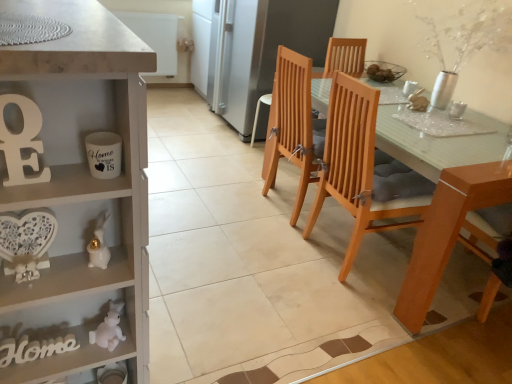
What do you see at coordinates (34, 349) in the screenshot?
I see `white wood home at lower left` at bounding box center [34, 349].

Describe the element at coordinates (252, 49) in the screenshot. The image size is (512, 384). I see `satin silver refrigerator at center` at that location.

Measure the distance between wooden chair with cushion at center, marked as the 2th chair in a right-to-left arrangement, and camera.

wooden chair with cushion at center, marked as the 2th chair in a right-to-left arrangement, is 1.73 meters away from camera.

Image resolution: width=512 pixels, height=384 pixels. Find the location of `white matte rabbit at lower left, which is counted as the first toy, starting from the back`. white matte rabbit at lower left, which is counted as the first toy, starting from the back is located at coordinates (109, 328).

How far apart are wooden chair with cushion at center, marked as the 2th chair in a right-to-left arrangement, and white painted wood cabinet at left?

wooden chair with cushion at center, marked as the 2th chair in a right-to-left arrangement, and white painted wood cabinet at left are 1.26 meters apart from each other.

From a real-world perspective, which object rests below the other?

wooden chair with cushion at center, marked as the 2th chair in a right-to-left arrangement, from a real-world perspective.

Can you tell me how much wooden chair with cushion at center, which ranks as the 2th chair in left-to-right order, and white painted wood cabinet at left differ in facing direction?

The angle between the facing direction of wooden chair with cushion at center, which ranks as the 2th chair in left-to-right order, and the facing direction of white painted wood cabinet at left is 0.36 degrees.

Considering the sizes of objects wooden chair with cushion at center, marked as the 2th chair in a right-to-left arrangement, and white painted wood cabinet at left in the image provided, who is smaller, wooden chair with cushion at center, marked as the 2th chair in a right-to-left arrangement, or white painted wood cabinet at left?

With smaller size is wooden chair with cushion at center, marked as the 2th chair in a right-to-left arrangement.

From a real-world perspective, between satin silver refrigerator at center and clear glass cup at upper right, positioned as the second coffee cup in top-to-bottom order, who is vertically higher?

In real-world perspective, clear glass cup at upper right, positioned as the second coffee cup in top-to-bottom order, is above.

Is clear glass cup at upper right, which is the 2th coffee cup in bottom-to-top order, surrounded by satin silver refrigerator at center?

No, satin silver refrigerator at center does not contain clear glass cup at upper right, which is the 2th coffee cup in bottom-to-top order.

Who is bigger, satin silver refrigerator at center or clear glass cup at upper right, which is the third coffee cup in left-to-right order?

satin silver refrigerator at center is bigger.

Which object is thinner, satin silver refrigerator at center or clear glass cup at upper right, positioned as the second coffee cup in top-to-bottom order?

clear glass cup at upper right, positioned as the second coffee cup in top-to-bottom order.

From the image's perspective, does white matte letter e at left appear higher than wooden chair at right, positioned as the 3th chair in left-to-right order?

Correct, white matte letter e at left appears higher than wooden chair at right, positioned as the 3th chair in left-to-right order, in the image.

Is white matte letter e at left looking in the opposite direction of wooden chair at right, placed as the 1th chair when sorted from right to left?

No, white matte letter e at left's orientation is not away from wooden chair at right, placed as the 1th chair when sorted from right to left.

Considering the sizes of objects white matte letter e at left and wooden chair at right, positioned as the 3th chair in left-to-right order, in the image provided, who is smaller, white matte letter e at left or wooden chair at right, positioned as the 3th chair in left-to-right order,?

white matte letter e at left.

In the image, is white matte letter e at left positioned in front of or behind wooden chair at right, placed as the 1th chair when sorted from right to left?

Clearly, white matte letter e at left is in front of wooden chair at right, placed as the 1th chair when sorted from right to left.

Is satin silver refrigerator at center inside the boundaries of wooden chair with cushion at center, marked as the 2th chair in a right-to-left arrangement, or outside?

satin silver refrigerator at center is outside wooden chair with cushion at center, marked as the 2th chair in a right-to-left arrangement.

Is satin silver refrigerator at center not near wooden chair with cushion at center, which ranks as the 2th chair in left-to-right order?

satin silver refrigerator at center is positioned a significant distance from wooden chair with cushion at center, which ranks as the 2th chair in left-to-right order.

Considering the relative sizes of satin silver refrigerator at center and wooden chair with cushion at center, which ranks as the 2th chair in left-to-right order, in the image provided, is satin silver refrigerator at center thinner than wooden chair with cushion at center, which ranks as the 2th chair in left-to-right order,?

In fact, satin silver refrigerator at center might be wider than wooden chair with cushion at center, which ranks as the 2th chair in left-to-right order.

The height and width of the screenshot is (384, 512). In order to click on toy that is the 1st object to the left of the clear glass cup at upper right, the 1th coffee cup from the right, starting at the anchor in this screenshot , I will do `click(99, 244)`.

From a real-world perspective, which object stands above the other?

clear glass cup at upper right, the 1th coffee cup from the right, is physically above.

Is the surface of clear glass cup at upper right, the 1th coffee cup from the right, in direct contact with white glossy rabbit at lower left, the first toy viewed from the front?

No.

Is wooden chair at right, placed as the 1th chair when sorted from right to left, in front of white painted wood cabinet at left?

No, wooden chair at right, placed as the 1th chair when sorted from right to left, is behind white painted wood cabinet at left.

From a real-world perspective, relative to white painted wood cabinet at left, is wooden chair at right, positioned as the 3th chair in left-to-right order, vertically above or below?

Clearly, from a real-world perspective, wooden chair at right, positioned as the 3th chair in left-to-right order, is below white painted wood cabinet at left.

Considering the relative positions of wooden chair at right, positioned as the 3th chair in left-to-right order, and white painted wood cabinet at left in the image provided, is wooden chair at right, positioned as the 3th chair in left-to-right order, to the right of white painted wood cabinet at left from the viewer's perspective?

Yes, wooden chair at right, positioned as the 3th chair in left-to-right order, is to the right of white painted wood cabinet at left.

Does wooden chair at right, placed as the 1th chair when sorted from right to left, have a lesser width compared to white painted wood cabinet at left?

Incorrect, the width of wooden chair at right, placed as the 1th chair when sorted from right to left, is not less than that of white painted wood cabinet at left.

From the image's perspective, is clear glass cup at upper right, positioned as the second coffee cup in top-to-bottom order, over white matte rabbit at lower left, acting as the second toy starting from the front?

Indeed, from the image's perspective, clear glass cup at upper right, positioned as the second coffee cup in top-to-bottom order, is shown above white matte rabbit at lower left, acting as the second toy starting from the front.

Is clear glass cup at upper right, the 1th coffee cup from the right, behind white matte rabbit at lower left, which is counted as the first toy, starting from the back?

That is True.

Find the location of a particular element. This screenshot has width=512, height=384. the 2nd toy to the left of the clear glass cup at upper right, the 1th coffee cup from the right, starting your count from the anchor is located at coordinates (109, 328).

Identify the location of chair that is the 1st one below the white painted wood cabinet at left (from a real-world perspective). This screenshot has width=512, height=384. (366, 168).

Find the location of `fridge behind the clear glass cup at upper right, positioned as the second coffee cup in top-to-bottom order`. fridge behind the clear glass cup at upper right, positioned as the second coffee cup in top-to-bottom order is located at coordinates 252,49.

From the image, which object appears to be nearer to white painted wood cabinet at left, white matte rabbit at lower left, acting as the second toy starting from the front, or white wood home at lower left?

Among the two, white matte rabbit at lower left, acting as the second toy starting from the front, is located nearer to white painted wood cabinet at left.

Consider the image. Considering their positions, is white wood home at lower left positioned closer to white painted wood cabinet at left than white matte rabbit at lower left, which is counted as the first toy, starting from the back?

Among the two, white matte rabbit at lower left, which is counted as the first toy, starting from the back, is located nearer to white painted wood cabinet at left.

Based on their spatial positions, is white glossy mug at left, the 3th coffee cup when ordered from right to left, or white painted wood cabinet at left further from light brown wood chair at center, the 3th chair in the right-to-left sequence?

white glossy mug at left, the 3th coffee cup when ordered from right to left.

Considering their positions, is white glossy mug at left, the first coffee cup when ordered from front to back, positioned further to white painted wood cabinet at left than clear glass cup at upper right, which is the 2th coffee cup in bottom-to-top order?

Based on the image, clear glass cup at upper right, which is the 2th coffee cup in bottom-to-top order, appears to be further to white painted wood cabinet at left.

Based on the photo, based on their spatial positions, is wooden chair with cushion at center, marked as the 2th chair in a right-to-left arrangement, or white glossy rabbit at lower left, the 1th toy from the top, closer to white matte rabbit at lower left, marked as the 1th toy in a bottom-to-top arrangement?

The object closer to white matte rabbit at lower left, marked as the 1th toy in a bottom-to-top arrangement, is white glossy rabbit at lower left, the 1th toy from the top.

From the picture: Looking at the image, which one is located closer to white glossy rabbit at lower left, which appears as the 2th toy when ordered from the bottom, white glossy coffee cup at upper right, which is counted as the third coffee cup, starting from the front, or white matte rabbit at lower left, the 2th toy when ordered from top to bottom?

white matte rabbit at lower left, the 2th toy when ordered from top to bottom, is closer to white glossy rabbit at lower left, which appears as the 2th toy when ordered from the bottom.

When comparing their distances from white matte letter e at left, does light brown wood chair at center, the 3th chair in the right-to-left sequence, or white painted wood cabinet at left seem closer?

white painted wood cabinet at left.

Based on their spatial positions, is white painted wood cabinet at left or clear glass cup at upper right, marked as the second coffee cup in a front-to-back arrangement, closer to white matte rabbit at lower left, acting as the second toy starting from the front?

Based on the image, white painted wood cabinet at left appears to be nearer to white matte rabbit at lower left, acting as the second toy starting from the front.

What are the coordinates of `alphabet situated between white wood home at lower left and wooden chair at right, placed as the 1th chair when sorted from right to left, from left to right` in the screenshot? It's located at (22, 142).

Locate an element on the screen. The image size is (512, 384). coffee cup located between satin silver refrigerator at center and clear glass cup at upper right, marked as the second coffee cup in a front-to-back arrangement, in the left-right direction is located at coordinates (409, 88).

Find the location of `coffee cup positioned between white matte letter e at left and white glossy rabbit at lower left, which appears as the 2th toy when ordered from the bottom, from near to far`. coffee cup positioned between white matte letter e at left and white glossy rabbit at lower left, which appears as the 2th toy when ordered from the bottom, from near to far is located at coordinates (104, 154).

Identify the location of cabinetry between white glossy mug at left, which is the 1th coffee cup from left to right, and white wood home at lower left vertically. The image size is (512, 384). (80, 187).